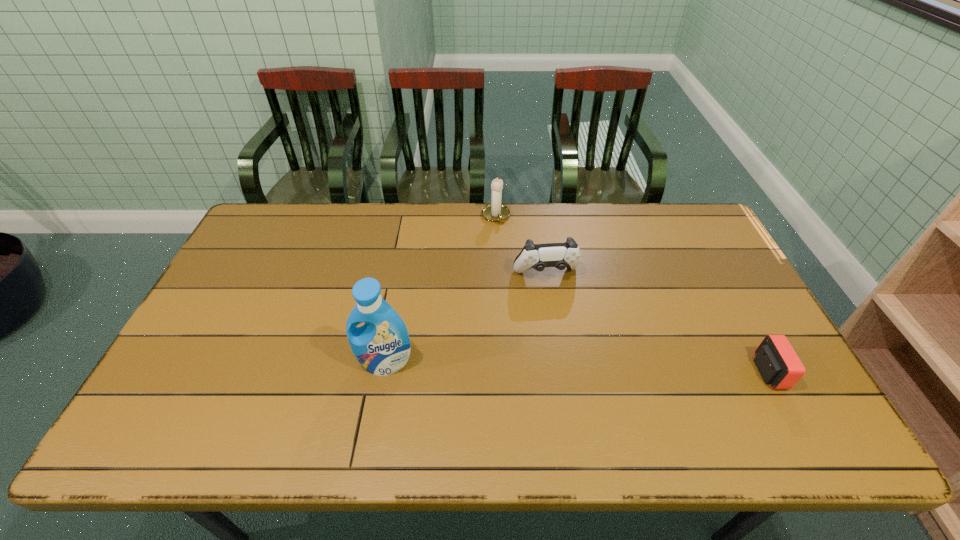
I want to click on free space on the desktop that is between the detergent and the shortest object and is positioned on the front-facing side of the second farthest object, so click(x=572, y=367).

Find the location of a particular element. This screenshot has height=540, width=960. vacant spot on the desktop that is between the leftmost object and the rightmost object and is positioned on the handle side of the second tallest object is located at coordinates (557, 367).